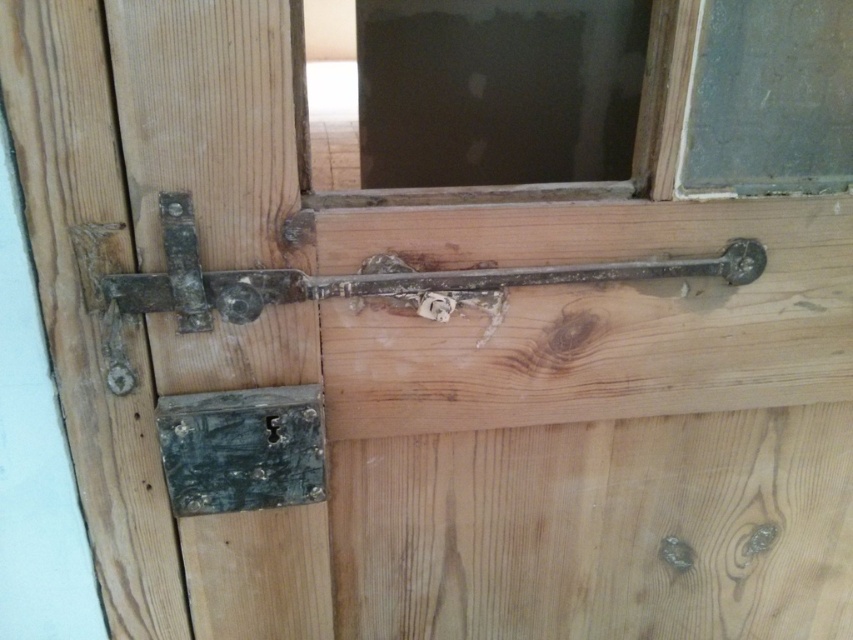
Between transparent glass window at upper center and rusty metal lock at lower left, which one has less height?

rusty metal lock at lower left is shorter.

The height and width of the screenshot is (640, 853). What do you see at coordinates (757, 97) in the screenshot?
I see `transparent glass window at upper center` at bounding box center [757, 97].

The width and height of the screenshot is (853, 640). What are the coordinates of `transparent glass window at upper center` in the screenshot? It's located at (757, 97).